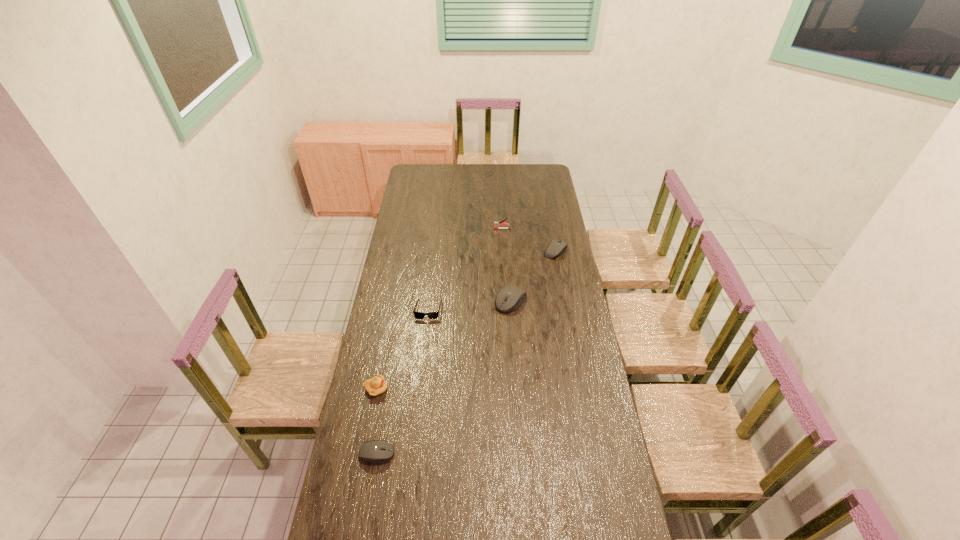
Image resolution: width=960 pixels, height=540 pixels. In the image, there is a desktop. In order to click on vacant area at the near edge in this screenshot , I will do `click(498, 520)`.

You are a GUI agent. You are given a task and a screenshot of the screen. Output one action in this format:
    pyautogui.click(x=<x>, y=<y>)
    Task: Click on the free region at the left edge of the desktop
    This screenshot has height=540, width=960.
    Given the screenshot: What is the action you would take?
    pyautogui.click(x=414, y=233)

The width and height of the screenshot is (960, 540). In order to click on free space at the right edge of the desktop in this screenshot , I will do `click(561, 235)`.

You are a GUI agent. You are given a task and a screenshot of the screen. Output one action in this format:
    pyautogui.click(x=<x>, y=<y>)
    Task: Click on the vacant space at the far left corner of the desktop
    Image resolution: width=960 pixels, height=540 pixels.
    Given the screenshot: What is the action you would take?
    pyautogui.click(x=420, y=169)

Locate an element on the screen. vacant space that is in between the duckling and the second shortest computer equipment is located at coordinates (466, 320).

Locate an element on the screen. Image resolution: width=960 pixels, height=540 pixels. vacant space that is in between the rightmost computer equipment and the second nearest object is located at coordinates pyautogui.click(x=466, y=320).

The height and width of the screenshot is (540, 960). Find the location of `vacant area that lies between the leftmost computer equipment and the farthest object`. vacant area that lies between the leftmost computer equipment and the farthest object is located at coordinates (440, 341).

Locate an element on the screen. This screenshot has height=540, width=960. vacant region between the fifth farthest object and the fourth object from right to left is located at coordinates (402, 349).

Where is `free spot between the third object from left to right and the duckling`? free spot between the third object from left to right and the duckling is located at coordinates (402, 349).

The image size is (960, 540). I want to click on vacant area between the fifth farthest object and the second nearest computer equipment, so click(444, 345).